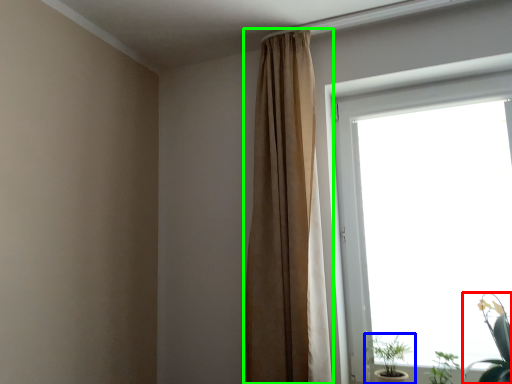
Question: Which object is positioned closest to houseplant (highlighted by a red box)? Select from houseplant (highlighted by a blue box) and curtain (highlighted by a green box).

Choices:
 (A) houseplant
 (B) curtain

Answer: (A)